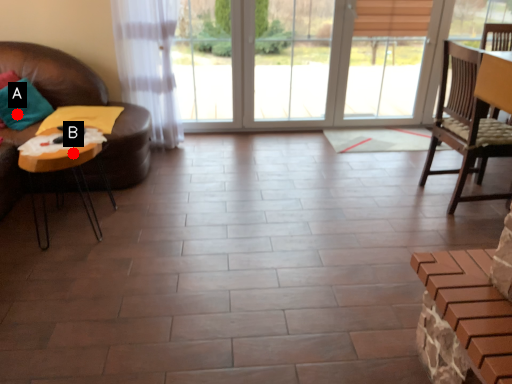
Question: Two points are circled on the image, labeled by A and B beside each circle. Among these points, which one is farthest from the camera?

Choices:
 (A) A is further
 (B) B is further

Answer: (A)